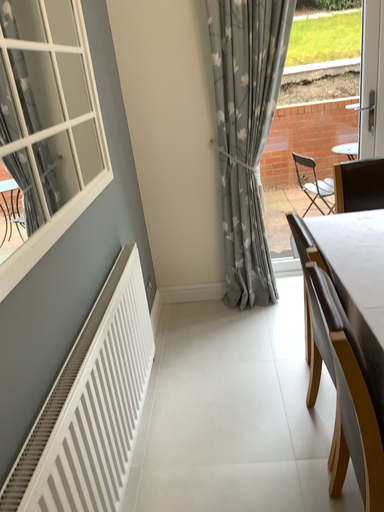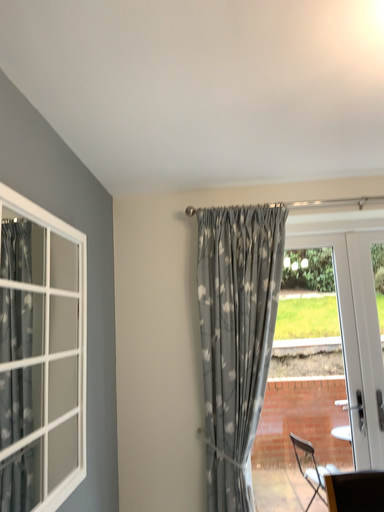
Question: How did the camera likely rotate when shooting the video?

Choices:
 (A) rotated downward
 (B) rotated upward

Answer: (B)